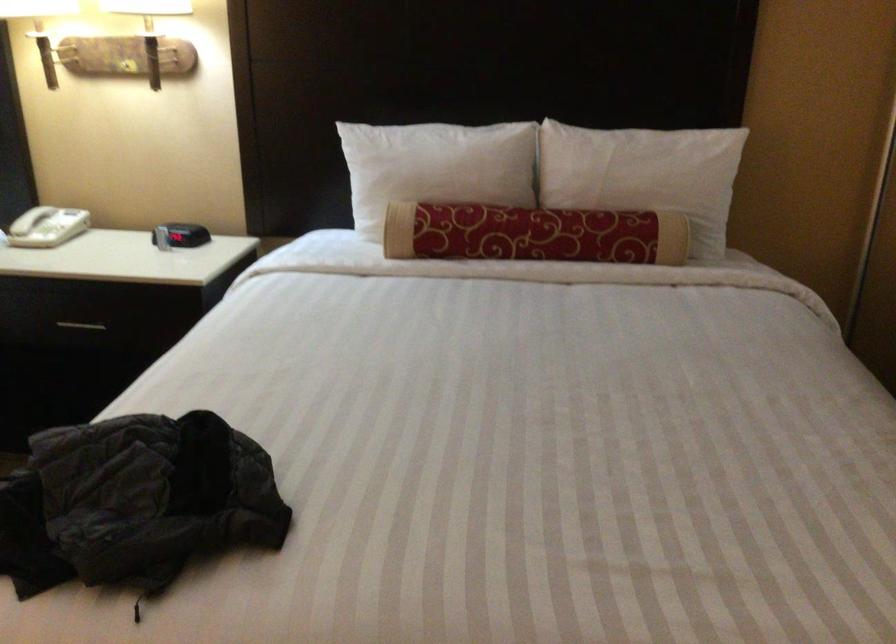
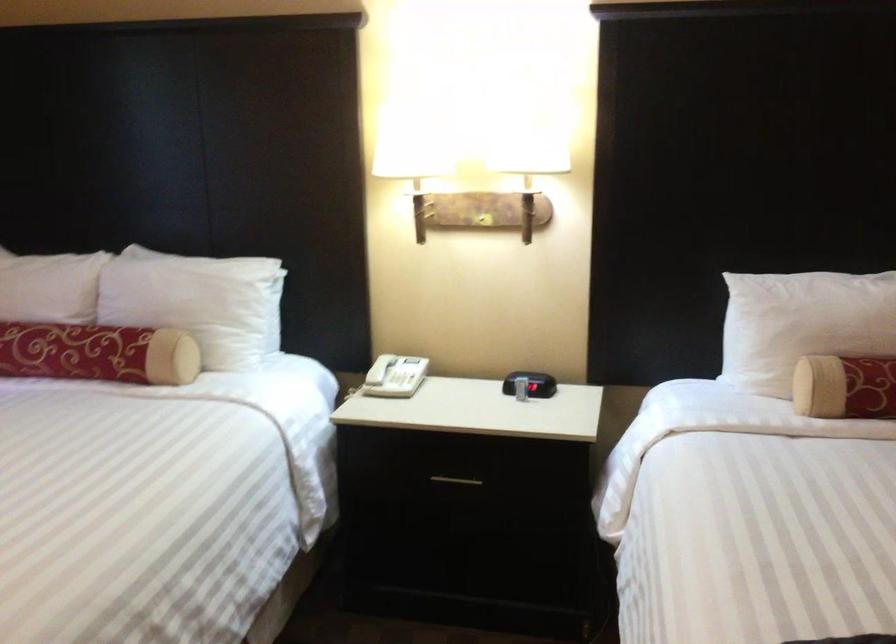
Question: The first image is from the beginning of the video and the second image is from the end. How did the camera likely rotate when shooting the video?

Choices:
 (A) Left
 (B) Right
 (C) Up
 (D) Down

Answer: (C)